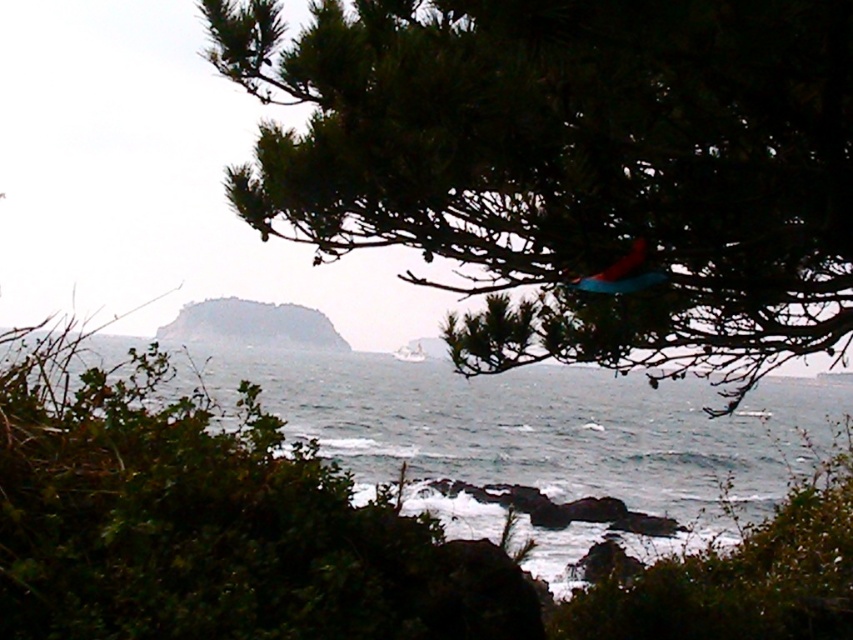
Question: Which of the following is the farthest from the observer?

Choices:
 (A) dark blue water at center
 (B) green matte tree at upper center

Answer: (A)

Question: Which of the following is the closest to the observer?

Choices:
 (A) matte blue kite at upper center
 (B) green matte tree at upper center
 (C) dark blue water at center

Answer: (B)

Question: Is dark blue water at center further to the viewer compared to matte blue kite at upper center?

Choices:
 (A) no
 (B) yes

Answer: (A)

Question: Which object is the farthest from the matte blue kite at upper center?

Choices:
 (A) green matte tree at upper center
 (B) dark blue water at center

Answer: (B)

Question: Can you confirm if dark blue water at center is positioned to the right of matte blue kite at upper center?

Choices:
 (A) no
 (B) yes

Answer: (B)

Question: Does green matte tree at upper center have a lesser width compared to matte blue kite at upper center?

Choices:
 (A) yes
 (B) no

Answer: (B)